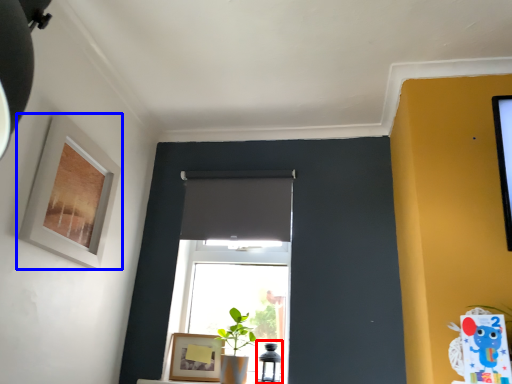
Question: Which of the following is the closest to the observer, table lamp (highlighted by a red box) or picture frame (highlighted by a blue box)?

Choices:
 (A) table lamp
 (B) picture frame

Answer: (B)